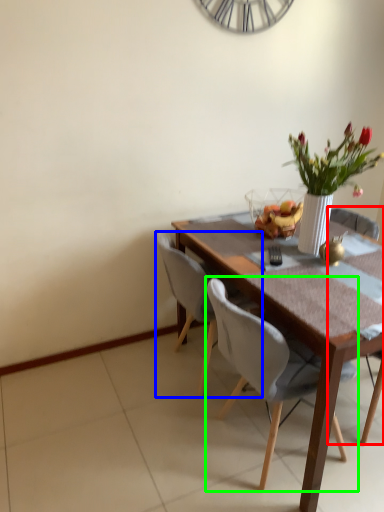
Question: Considering the real-world distances, which object is farthest from chair (highlighted by a red box)? chair (highlighted by a blue box) or chair (highlighted by a green box)?

Choices:
 (A) chair
 (B) chair

Answer: (B)